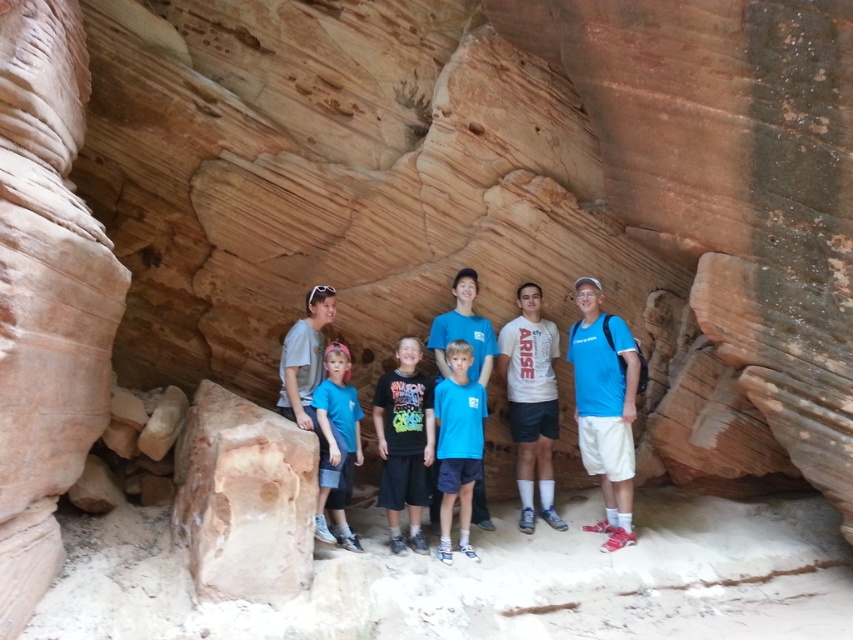
Is black matte t-shirt at center positioned in front of blue cotton t-shirts at center?

Yes, black matte t-shirt at center is in front of blue cotton t-shirts at center.

Is point (392, 500) farther from camera compared to point (553, 422)?

No, it is not.

You are a GUI agent. You are given a task and a screenshot of the screen. Output one action in this format:
    pyautogui.click(x=<x>, y=<y>)
    Task: Click on the black matte t-shirt at center
    This screenshot has width=853, height=640.
    Given the screenshot: What is the action you would take?
    pyautogui.click(x=404, y=442)

Is point (619, 358) positioned before point (463, 300)?

That is True.

Which is above, blue cotton shirt at center or blue cotton t-shirts at center?

blue cotton t-shirts at center

Is point (593, 355) more distant than point (611, 488)?

Yes, it is behind point (611, 488).

Where is `blue cotton shirt at center`? blue cotton shirt at center is located at coordinates (605, 406).

Is black matte t-shirt at center smaller than blue matte shirt at center?

No.

You are a GUI agent. You are given a task and a screenshot of the screen. Output one action in this format:
    pyautogui.click(x=<x>, y=<y>)
    Task: Click on the black matte t-shirt at center
    
    Given the screenshot: What is the action you would take?
    pyautogui.click(x=404, y=442)

The width and height of the screenshot is (853, 640). What do you see at coordinates (404, 442) in the screenshot?
I see `black matte t-shirt at center` at bounding box center [404, 442].

The width and height of the screenshot is (853, 640). Identify the location of black matte t-shirt at center. (404, 442).